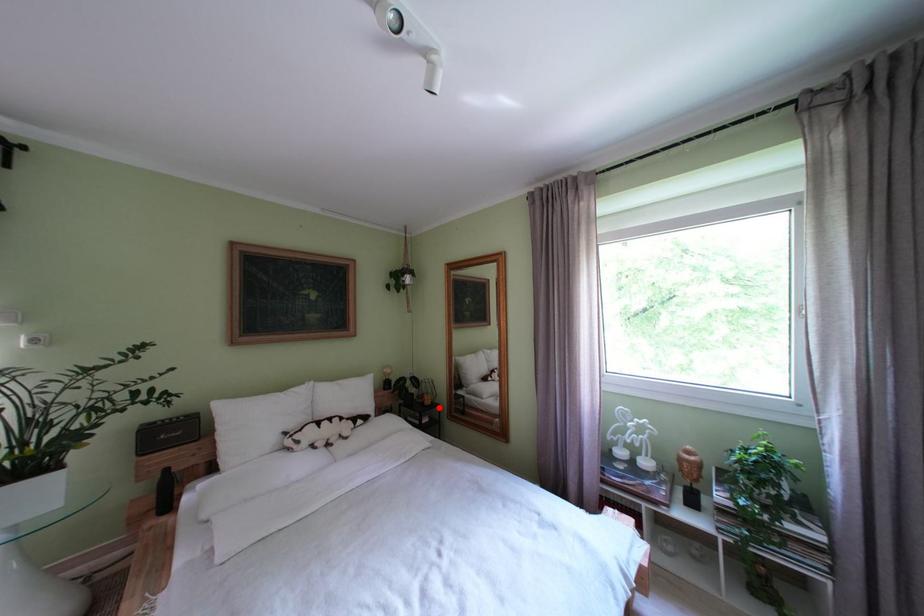
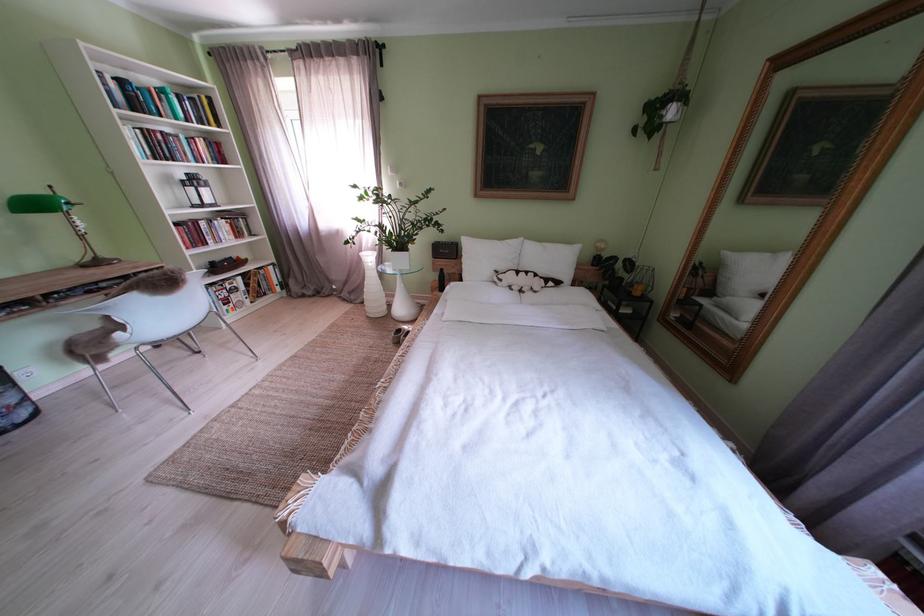
Question: I am providing you with two images of the same scene from different viewpoints. In image1, a red point is highlighted. Considering the same 3D point in image2, which of the following is correct?

Choices:
 (A) It is closer
 (B) It is farther

Answer: (A)